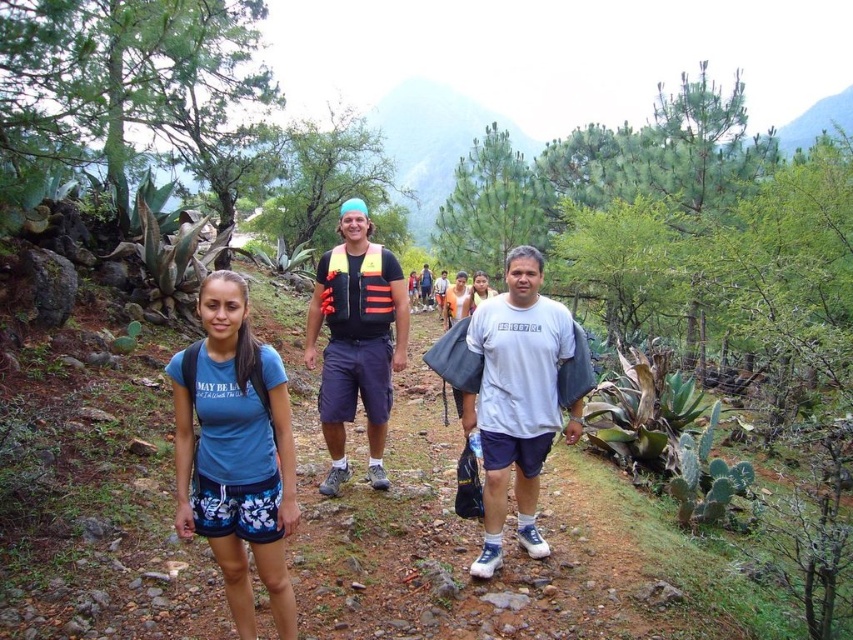
You are a hiker who wants to check if the blue fabric shorts at lower left are positioned lower than the orange mesh life vest at center. Based on the scene description, can you confirm this?

Yes, according to the scene description, the blue fabric shorts at lower left is below orange mesh life vest at center.